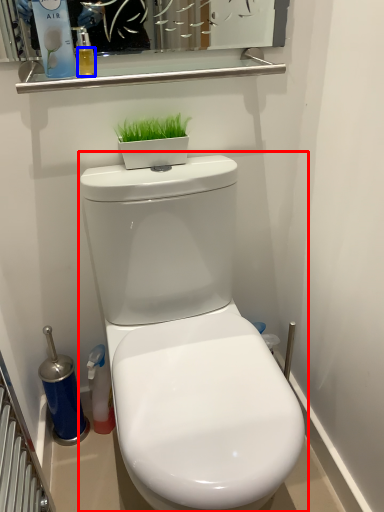
Question: Which object appears closest to the camera in this image, toilet (highlighted by a red box) or liquid (highlighted by a blue box)?

Choices:
 (A) toilet
 (B) liquid

Answer: (A)